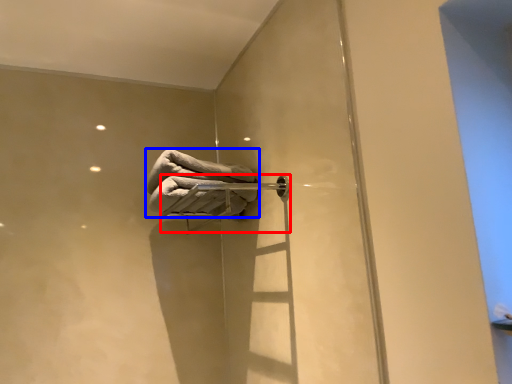
Question: Which object is further to the camera taking this photo, towel bar (highlighted by a red box) or towel (highlighted by a blue box)?

Choices:
 (A) towel bar
 (B) towel

Answer: (B)